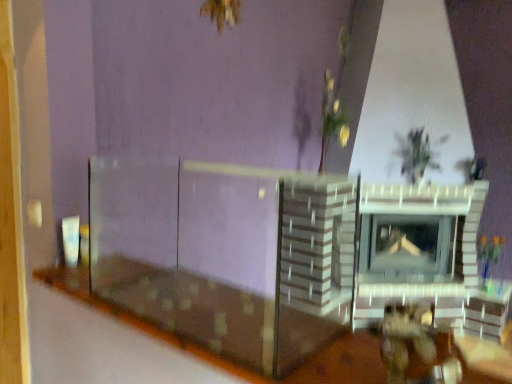
This screenshot has width=512, height=384. What do you see at coordinates (135, 319) in the screenshot? I see `wooden table at lower center` at bounding box center [135, 319].

Find the location of a particular element. This screenshot has width=512, height=384. wooden table at lower center is located at coordinates (135, 319).

Looking at this image, what is the approximate height of green leafy plant at upper right?

green leafy plant at upper right is 7.20 inches in height.

Describe the element at coordinates (472, 168) in the screenshot. I see `green leafy plant at upper right` at that location.

I want to click on green leafy plant at upper right, so click(472, 168).

You are a GUI agent. You are given a task and a screenshot of the screen. Output one action in this format:
    pyautogui.click(x=<x>, y=<y>)
    Task: Click on the wooden table at lower center
    Image resolution: width=512 pixels, height=384 pixels.
    Given the screenshot: What is the action you would take?
    pyautogui.click(x=135, y=319)

Considering the relative positions of green leafy plant at upper right and wooden table at lower center in the image provided, is green leafy plant at upper right to the right of wooden table at lower center from the viewer's perspective?

Indeed, green leafy plant at upper right is positioned on the right side of wooden table at lower center.

Considering the positions of objects green leafy plant at upper right and wooden table at lower center in the image provided, who is behind, green leafy plant at upper right or wooden table at lower center?

green leafy plant at upper right.

Between point (466, 174) and point (56, 290), which one is positioned in front?

The point (56, 290) is closer.

From the image's perspective, is green leafy plant at upper right beneath wooden table at lower center?

Actually, green leafy plant at upper right appears above wooden table at lower center in the image.

From a real-world perspective, is green leafy plant at upper right beneath wooden table at lower center?

No, from a real-world perspective, green leafy plant at upper right is not under wooden table at lower center.

Can you confirm if green leafy plant at upper right is wider than wooden table at lower center?

In fact, green leafy plant at upper right might be narrower than wooden table at lower center.

Which of these two, green leafy plant at upper right or wooden table at lower center, stands taller?

green leafy plant at upper right.

Considering the relative sizes of green leafy plant at upper right and wooden table at lower center in the image provided, is green leafy plant at upper right smaller than wooden table at lower center?

Yes.

Is green leafy plant at upper right outside of wooden table at lower center?

That's correct, green leafy plant at upper right is outside of wooden table at lower center.

Are green leafy plant at upper right and wooden table at lower center located far from each other?

Indeed, green leafy plant at upper right is not near wooden table at lower center.

From the picture: Is green leafy plant at upper right facing away from wooden table at lower center?

No, green leafy plant at upper right's orientation is not away from wooden table at lower center.

At what (x,y) coordinates should I click in order to perform the action: click on plant above the wooden table at lower center (from a real-world perspective). Please return your answer as a coordinate pair (x, y). The image size is (512, 384). Looking at the image, I should click on (472, 168).

Between wooden table at lower center and green leafy plant at upper right, which one appears on the left side from the viewer's perspective?

Positioned to the left is wooden table at lower center.

Relative to green leafy plant at upper right, is wooden table at lower center in front or behind?

In the image, wooden table at lower center appears in front of green leafy plant at upper right.

Does point (78, 288) lie behind point (481, 159)?

No.

From the image's perspective, would you say wooden table at lower center is shown under green leafy plant at upper right?

Indeed, from the image's perspective, wooden table at lower center is shown beneath green leafy plant at upper right.

From a real-world perspective, who is located lower, wooden table at lower center or green leafy plant at upper right?

wooden table at lower center, from a real-world perspective.

Which object is wider, wooden table at lower center or green leafy plant at upper right?

Wider between the two is wooden table at lower center.

Can you confirm if wooden table at lower center is taller than green leafy plant at upper right?

In fact, wooden table at lower center may be shorter than green leafy plant at upper right.

Between wooden table at lower center and green leafy plant at upper right, which one has larger size?

wooden table at lower center is bigger.

Is wooden table at lower center outside of green leafy plant at upper right?

Indeed, wooden table at lower center is completely outside green leafy plant at upper right.

Is wooden table at lower center not near green leafy plant at upper right?

Yes.

Consider the image. Could you tell me if wooden table at lower center is turned towards green leafy plant at upper right?

No, wooden table at lower center is not oriented towards green leafy plant at upper right.

Image resolution: width=512 pixels, height=384 pixels. I want to click on plant behind the wooden table at lower center, so click(472, 168).

At what (x,y) coordinates should I click in order to perform the action: click on plant above the wooden table at lower center (from the image's perspective). Please return your answer as a coordinate pair (x, y). Looking at the image, I should click on (472, 168).

You are a GUI agent. You are given a task and a screenshot of the screen. Output one action in this format:
    pyautogui.click(x=<x>, y=<y>)
    Task: Click on the plant behind the wooden table at lower center
    This screenshot has width=512, height=384.
    Given the screenshot: What is the action you would take?
    pyautogui.click(x=472, y=168)